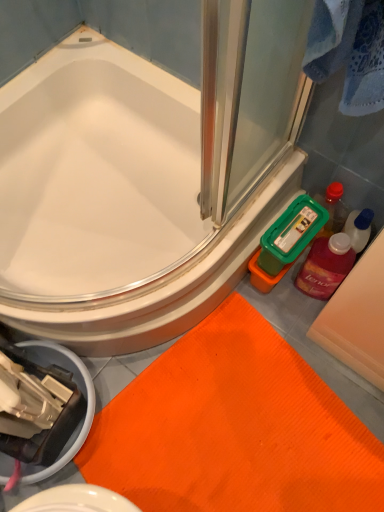
I want to click on vacant space underneath orange textured bath mat at lower center (from a real-world perspective), so click(x=253, y=436).